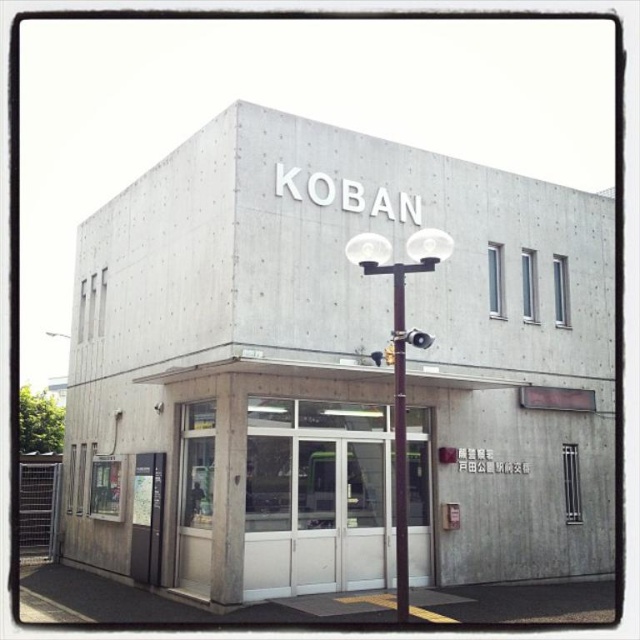
Is concrete building at center to the left of smooth concrete sign at lower left from the viewer's perspective?

Incorrect, concrete building at center is not on the left side of smooth concrete sign at lower left.

Is concrete building at center closer to camera compared to smooth concrete sign at lower left?

Yes, it is in front of smooth concrete sign at lower left.

Does point (99, 333) lie behind point (141, 573)?

Yes, point (99, 333) is behind point (141, 573).

Image resolution: width=640 pixels, height=640 pixels. Find the location of `concrete building at center`. concrete building at center is located at coordinates (340, 368).

Between concrete building at center and brown polished metal streetlight at center, which one is positioned lower?

concrete building at center is lower down.

How far apart are concrete building at center and brown polished metal streetlight at center?

A distance of 19.41 feet exists between concrete building at center and brown polished metal streetlight at center.

Which is in front, point (337, 332) or point (433, 228)?

Positioned in front is point (337, 332).

Where is `concrete building at center`? Image resolution: width=640 pixels, height=640 pixels. concrete building at center is located at coordinates (340, 368).

Who is taller, brown polished metal streetlight at center or white concrete pole at center?

With more height is white concrete pole at center.

From the picture: Does brown polished metal streetlight at center appear on the right side of white concrete pole at center?

Indeed, brown polished metal streetlight at center is positioned on the right side of white concrete pole at center.

Is point (388, 257) farther from camera compared to point (394, 392)?

No, (388, 257) is closer to viewer.

Locate an element on the screen. The width and height of the screenshot is (640, 640). brown polished metal streetlight at center is located at coordinates (401, 358).